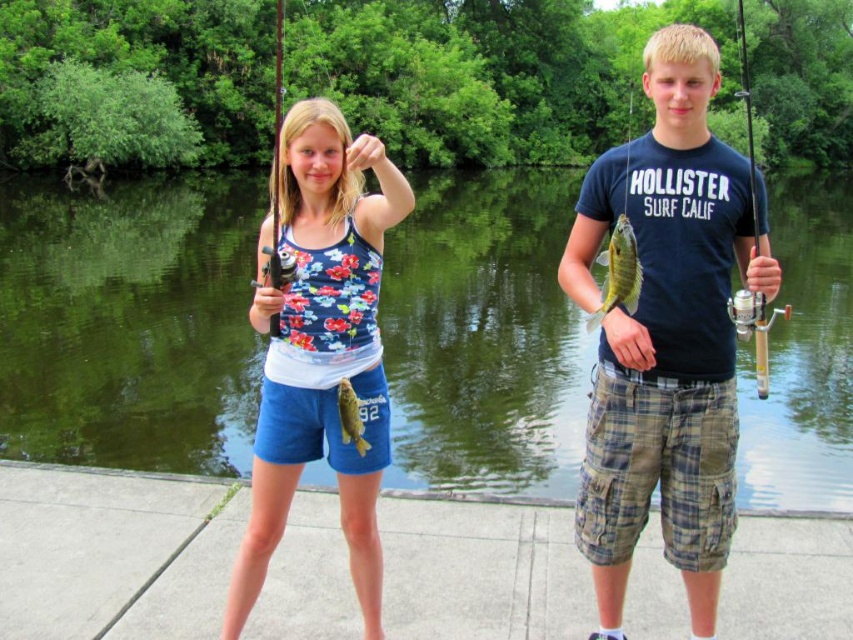
Can you confirm if green shiny fish at center is bigger than shiny green fish at center?

Yes.

Is point (619, 248) positioned before point (354, 396)?

Yes, it is.

Who is more forward, (635, 260) or (345, 387)?

Point (635, 260) is more forward.

Where is `green shiny fish at center`? The width and height of the screenshot is (853, 640). green shiny fish at center is located at coordinates (618, 273).

Measure the distance from green smooth water at center to green shiny fish at center.

green smooth water at center and green shiny fish at center are 22.32 meters apart from each other.

Between green smooth water at center and green shiny fish at center, which one is positioned higher?

green smooth water at center is above.

What do you see at coordinates (129, 323) in the screenshot?
I see `green smooth water at center` at bounding box center [129, 323].

You are a GUI agent. You are given a task and a screenshot of the screen. Output one action in this format:
    pyautogui.click(x=<x>, y=<y>)
    Task: Click on the green smooth water at center
    
    Given the screenshot: What is the action you would take?
    click(x=129, y=323)

At what (x,y) coordinates should I click in order to perform the action: click on matte black shirt at center. Please return your answer as a coordinate pair (x, y). Looking at the image, I should click on (666, 336).

Which is in front, point (694, 170) or point (367, 442)?

Point (694, 170) is in front.

Locate an element on the screen. The width and height of the screenshot is (853, 640). matte black shirt at center is located at coordinates (666, 336).